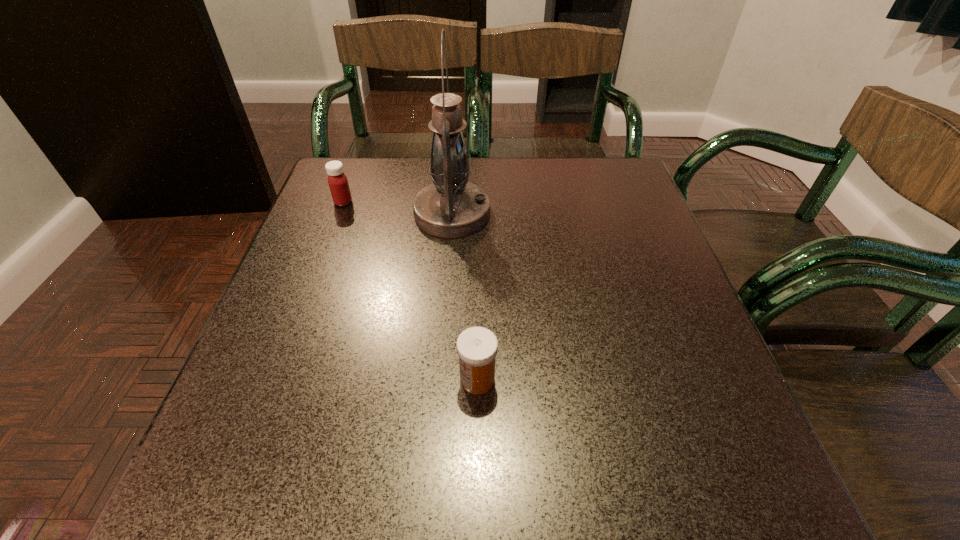
The image size is (960, 540). Find the location of `vacant space that's between the oil lamp and the left medicine`. vacant space that's between the oil lamp and the left medicine is located at coordinates [x=397, y=208].

I want to click on unoccupied area between the nearer medicine and the oil lamp, so click(465, 296).

At what (x,y) coordinates should I click in order to perform the action: click on unoccupied area between the tallest object and the left medicine. Please return your answer as a coordinate pair (x, y). This screenshot has width=960, height=540. Looking at the image, I should click on (397, 208).

Image resolution: width=960 pixels, height=540 pixels. In order to click on vacant region between the leftmost object and the nearest object in this screenshot , I will do `click(410, 291)`.

Where is `free space between the left medicine and the nearest object`? This screenshot has width=960, height=540. free space between the left medicine and the nearest object is located at coordinates (410, 291).

Identify the location of empty space between the nearest object and the tallest object. The width and height of the screenshot is (960, 540). [x=465, y=296].

Identify the location of free spot between the oil lamp and the farther medicine. (397, 208).

Find the location of a particular element. The image size is (960, 540). vacant space in between the nearer medicine and the farther medicine is located at coordinates (410, 291).

At what (x,y) coordinates should I click in order to perform the action: click on object identified as the closest to the right medicine. Please return your answer as a coordinate pair (x, y). The image size is (960, 540). Looking at the image, I should click on (451, 207).

The image size is (960, 540). I want to click on object that stands as the second closest to the left medicine, so click(477, 347).